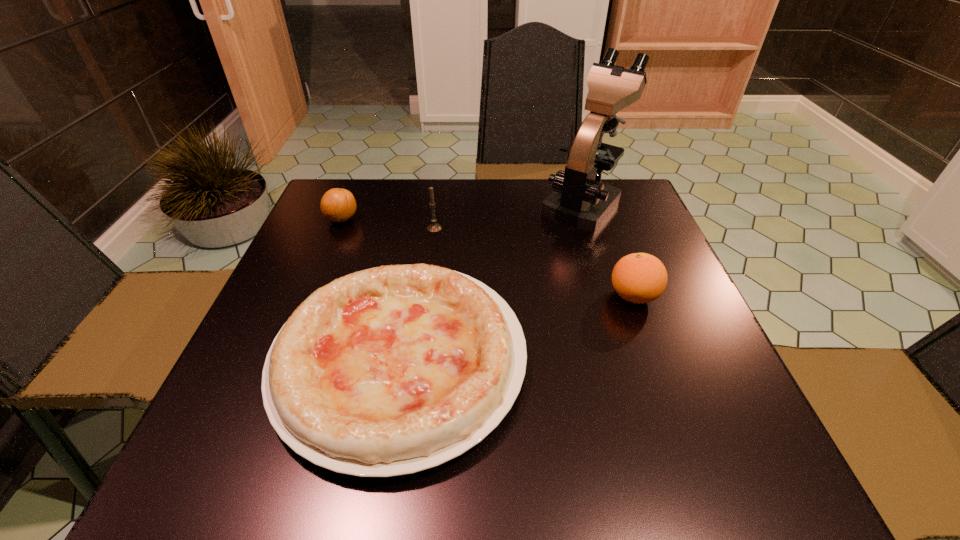
At what (x,y) coordinates should I click in order to perform the action: click on free spot that satisfies the following two spatial constraints: 1. on the back side of the tallest object; 2. on the left side of the pizza. Please return your answer as a coordinate pair (x, y). Looking at the image, I should click on [426, 204].